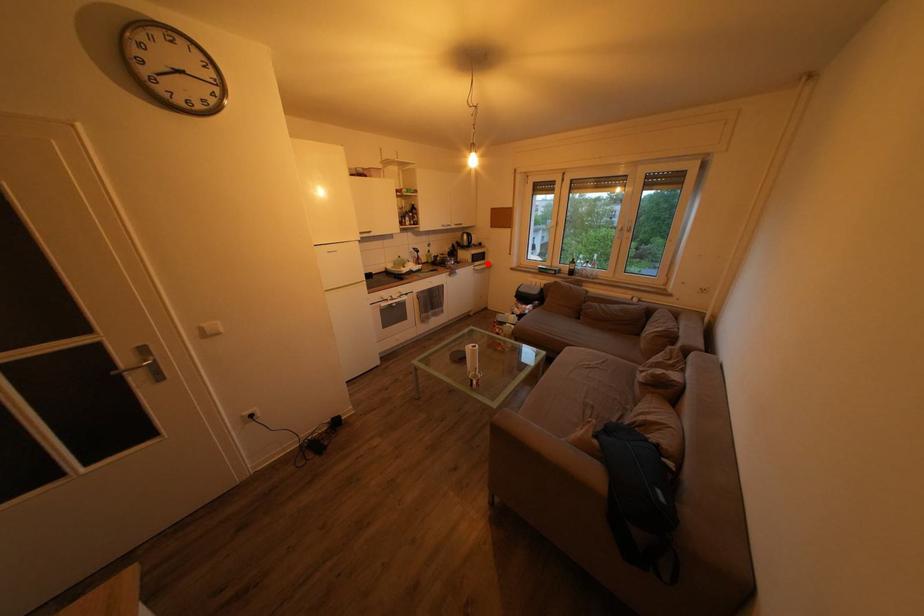
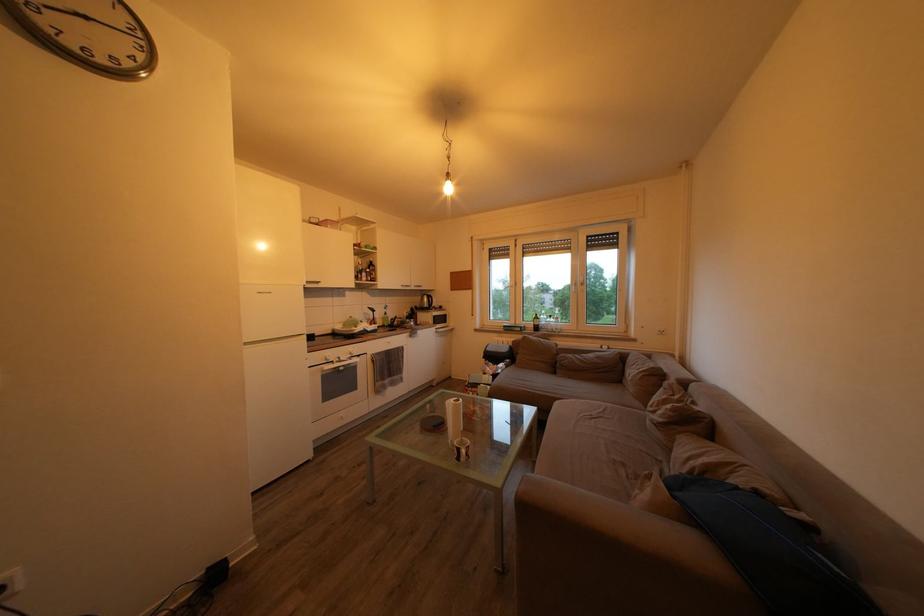
Find the pixel in the second image that matches the highlighted location in the first image.

(448, 326)